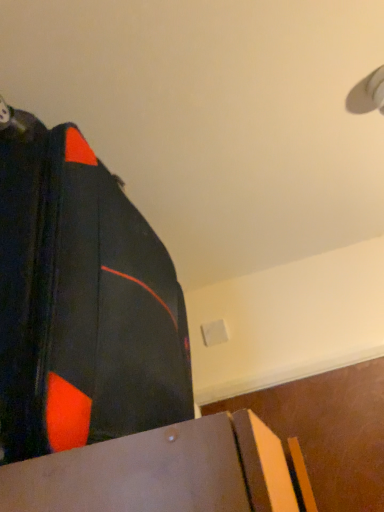
Describe the element at coordinates (81, 301) in the screenshot. This screenshot has height=512, width=384. I see `matte black bag at left` at that location.

Measure the distance between point (154, 286) and camera.

27.76 inches.

Locate an element on the screen. matte black bag at left is located at coordinates (81, 301).

Where is `matte black bag at left`? The width and height of the screenshot is (384, 512). matte black bag at left is located at coordinates click(81, 301).